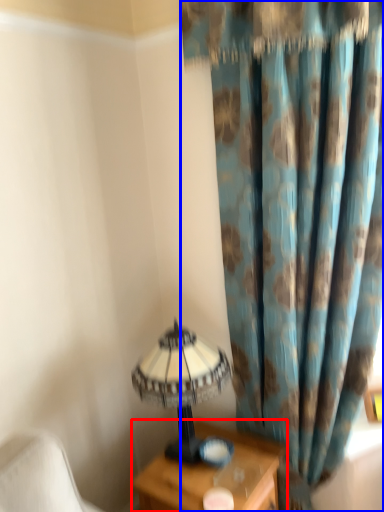
Question: Which of the following is the closest to the observer, nightstand (highlighted by a red box) or curtain (highlighted by a blue box)?

Choices:
 (A) nightstand
 (B) curtain

Answer: (B)